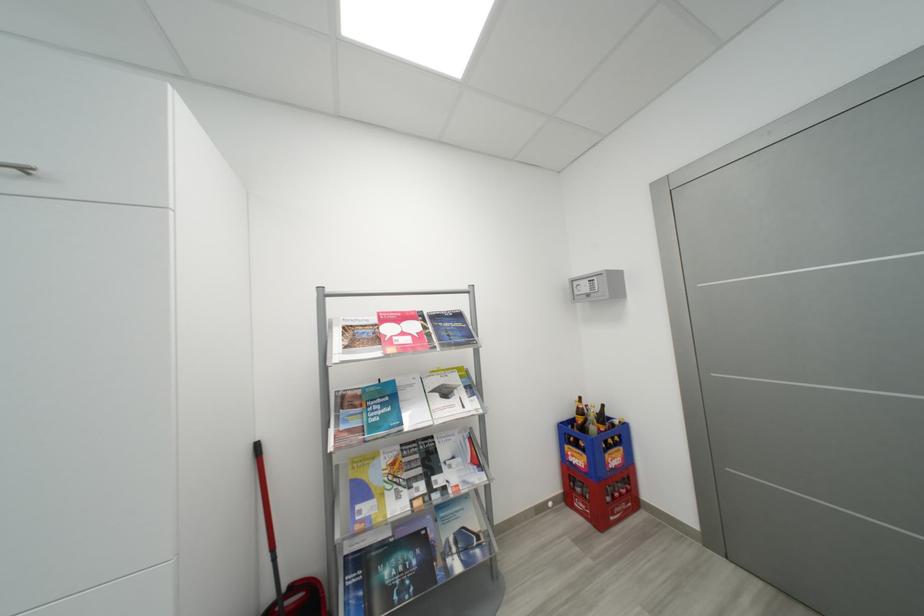
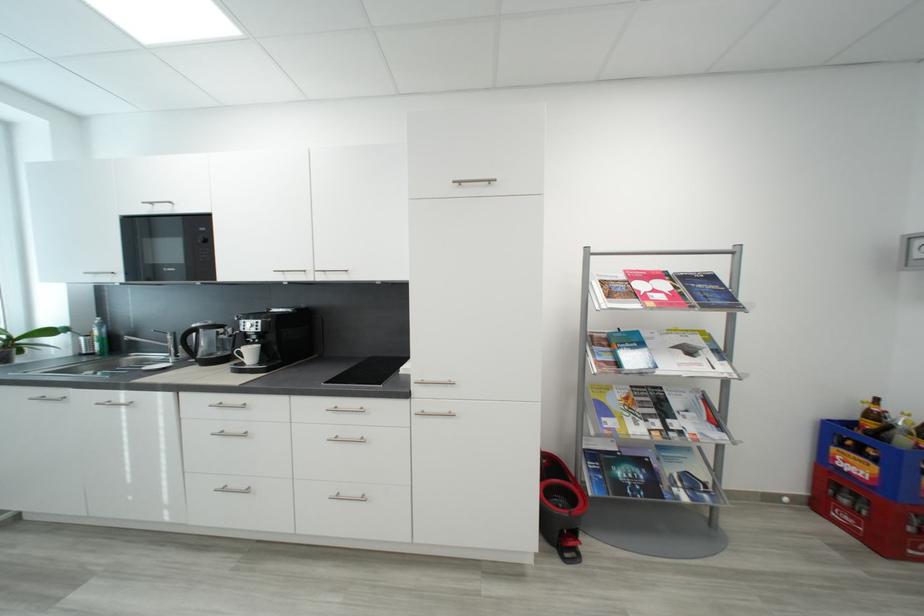
Find the pixel in the second image that matches (451,454) in the first image.

(684, 406)